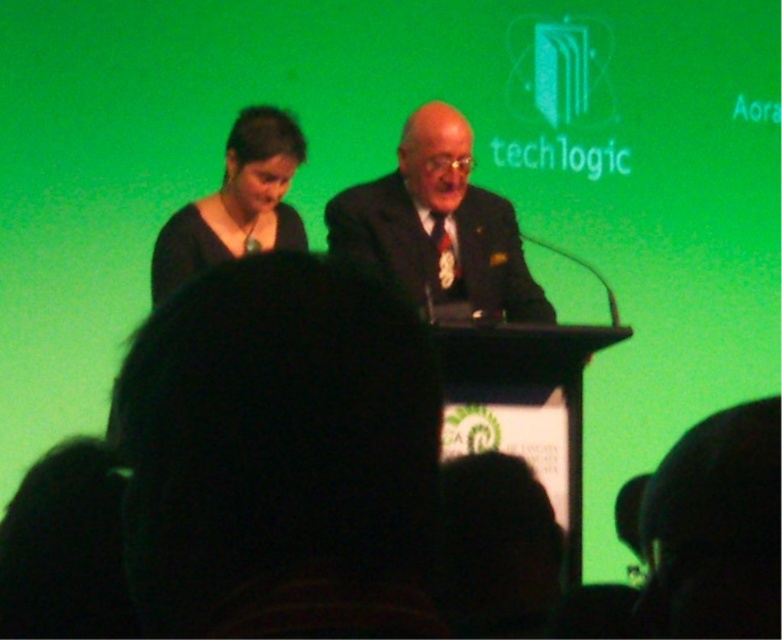
Question: Among these points, which one is nearest to the camera?

Choices:
 (A) (282, 116)
 (B) (542, 310)

Answer: (B)

Question: Which of the following is the farthest from the observer?

Choices:
 (A) matte black dress at upper left
 (B) dark suit at center

Answer: (A)

Question: Is dark suit at center wider than matte black dress at upper left?

Choices:
 (A) no
 (B) yes

Answer: (B)

Question: Where is dark suit at center located in relation to matte black dress at upper left in the image?

Choices:
 (A) right
 (B) left

Answer: (A)

Question: Is dark suit at center further to camera compared to matte black dress at upper left?

Choices:
 (A) yes
 (B) no

Answer: (B)